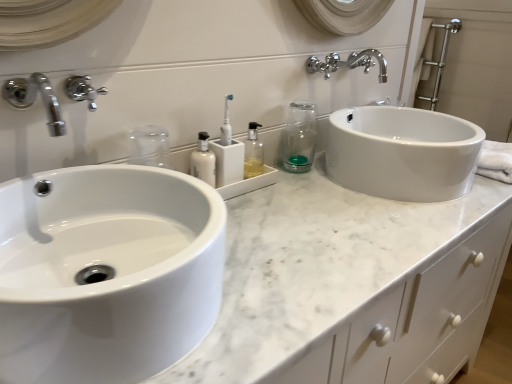
Question: Is white marble countertop at center wider than white plastic toothbrush at center?

Choices:
 (A) no
 (B) yes

Answer: (B)

Question: Is white marble countertop at center positioned far away from white plastic toothbrush at center?

Choices:
 (A) no
 (B) yes

Answer: (A)

Question: Can you confirm if white marble countertop at center is positioned to the right of white plastic toothbrush at center?

Choices:
 (A) no
 (B) yes

Answer: (B)

Question: Is white marble countertop at center facing towards white plastic toothbrush at center?

Choices:
 (A) yes
 (B) no

Answer: (B)

Question: Considering the relative sizes of white marble countertop at center and white plastic toothbrush at center in the image provided, is white marble countertop at center bigger than white plastic toothbrush at center?

Choices:
 (A) no
 (B) yes

Answer: (B)

Question: From the image's perspective, is transparent glass at center, which appears as the 1th mouthwash when viewed from the right, positioned above or below white glossy sink at left?

Choices:
 (A) above
 (B) below

Answer: (A)

Question: From a real-world perspective, is transparent glass at center, which appears as the 1th mouthwash when viewed from the right, physically located above or below white glossy sink at left?

Choices:
 (A) below
 (B) above

Answer: (B)

Question: Considering the positions of point (305, 117) and point (168, 296), is point (305, 117) closer or farther from the camera than point (168, 296)?

Choices:
 (A) closer
 (B) farther

Answer: (B)

Question: Considering the positions of transparent glass at center, the 2th mouthwash in the left-to-right sequence, and white glossy sink at left in the image, is transparent glass at center, the 2th mouthwash in the left-to-right sequence, bigger or smaller than white glossy sink at left?

Choices:
 (A) big
 (B) small

Answer: (B)

Question: Considering the positions of point (335, 317) and point (258, 153), is point (335, 317) closer or farther from the camera than point (258, 153)?

Choices:
 (A) closer
 (B) farther

Answer: (A)

Question: From a real-world perspective, is white marble countertop at center physically located above or below translucent plastic bottle at center?

Choices:
 (A) above
 (B) below

Answer: (B)

Question: Visually, is white marble countertop at center positioned to the left or to the right of translucent plastic bottle at center?

Choices:
 (A) left
 (B) right

Answer: (B)

Question: Which is correct: white marble countertop at center is inside translucent plastic bottle at center, or outside of it?

Choices:
 (A) inside
 (B) outside

Answer: (B)

Question: From the image's perspective, is polished chrome faucet at upper center located above or below translucent plastic bottle at center?

Choices:
 (A) above
 (B) below

Answer: (A)

Question: Is point (315, 67) closer or farther from the camera than point (250, 145)?

Choices:
 (A) farther
 (B) closer

Answer: (A)